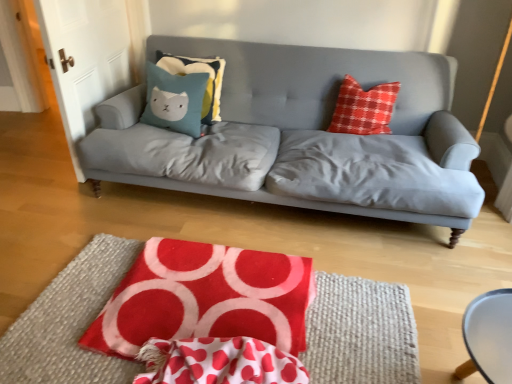
Question: Is teal fabric pillow with cat design at center, which appears as the 1th pillow when viewed from the back, situated inside red velvety quilt at lower center or outside?

Choices:
 (A) inside
 (B) outside

Answer: (B)

Question: From the image's perspective, is teal fabric pillow with cat design at center, which appears as the 1th pillow when viewed from the back, above or below red velvety quilt at lower center?

Choices:
 (A) below
 (B) above

Answer: (B)

Question: Estimate the real-world distances between objects in this image. Which object is farther from the smooth white table at lower right?

Choices:
 (A) red plaid pillow at upper right
 (B) teal plush pillow at center-left, the 2th pillow from the back
 (C) matte gray couch at center
 (D) teal fabric pillow with cat design at center, which appears as the 1th pillow when viewed from the back
 (E) red felt rug at center

Answer: (D)

Question: Based on their relative distances, which object is nearer to the red polka dot fabric at center?

Choices:
 (A) smooth white table at lower right
 (B) teal fabric pillow with cat design at center, which appears as the 1th pillow when viewed from the back
 (C) red velvety quilt at lower center
 (D) red plaid pillow at upper right
 (E) red felt rug at center

Answer: (C)